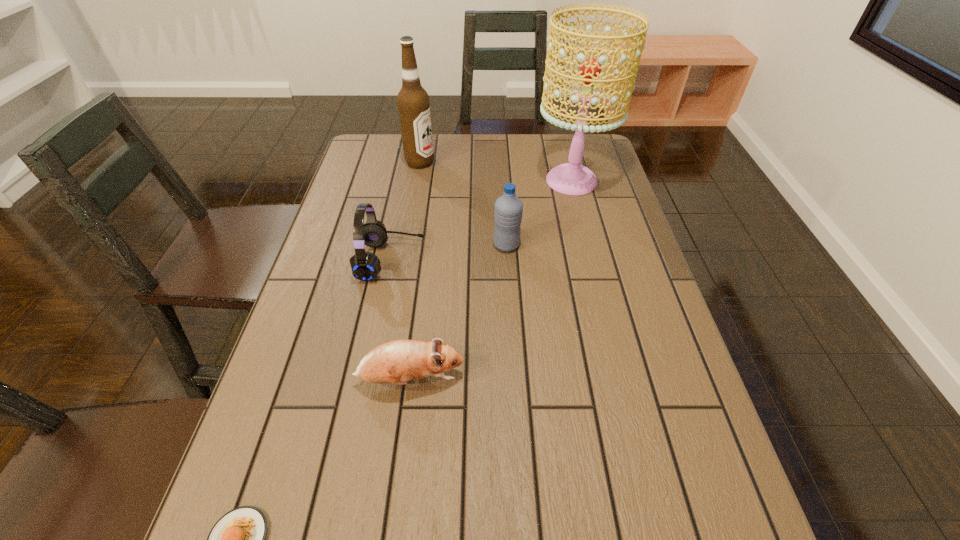
Identify the location of vacant space that satisfies the following two spatial constraints: 1. on the label of the alcohol; 2. on the right side of the second object from right to left. The width and height of the screenshot is (960, 540). (405, 245).

Identify the location of vacant region that satisfies the following two spatial constraints: 1. on the label of the rightmost object; 2. on the right side of the second tallest object. This screenshot has height=540, width=960. (417, 181).